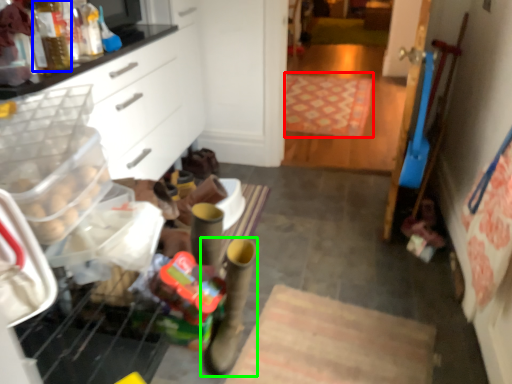
Question: Based on their relative distances, which object is nearer to mat (highlighted by a red box)? Choose from bottle (highlighted by a blue box) and footwear (highlighted by a green box).

Choices:
 (A) bottle
 (B) footwear

Answer: (B)